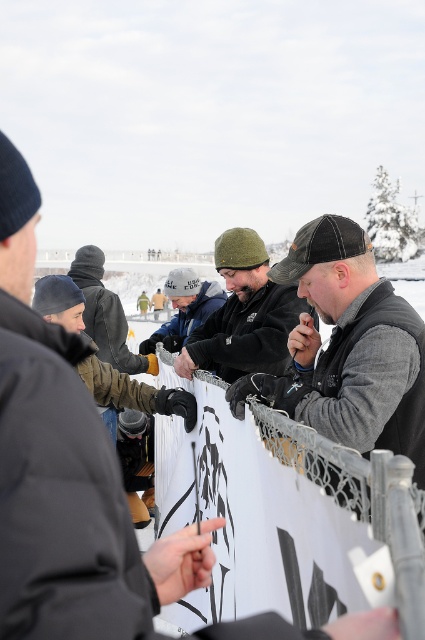
You are a photographer trying to capture a clear shot of the gray woolen sweater at center and the white knit cap at center. Since you want both items to be visible in the photo, would adjusting your camera angle help ensure both are in focus?

The gray woolen sweater at center is in front of the white knit cap at center. By adjusting your camera angle slightly, you can position yourself so that both items are in the same focal plane, ensuring both are visible and in focus in the photo.

You are a photographer trying to capture a clear shot of both the gray woolen sweater at center and the white knit cap at center. Since they are both at the center, will you need to adjust your camera focus to capture both clearly?

The gray woolen sweater at center is taller than the white knit cap at center, so you can focus on the gray woolen sweater at center and still capture the white knit cap at center clearly since they are both at the same distance from the camera.